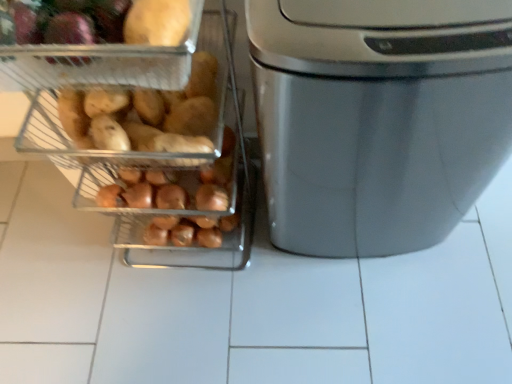
Describe the element at coordinates (378, 118) in the screenshot. I see `satin silver trash can at right` at that location.

This screenshot has height=384, width=512. Identify the location of metallic silver trash can at right. (157, 156).

Find the location of `satin silver trash can at right`. satin silver trash can at right is located at coordinates (378, 118).

Which of these two, satin silver trash can at right or metallic silver trash can at right, is thinner?

satin silver trash can at right.

Would you say satin silver trash can at right is a long distance from metallic silver trash can at right?

No.

Is satin silver trash can at right turned away from metallic silver trash can at right?

No, satin silver trash can at right is not facing the opposite direction of metallic silver trash can at right.

From the image's perspective, relative to metallic silver trash can at right, is satin silver trash can at right above or below?

Clearly, from the image's perspective, satin silver trash can at right is above metallic silver trash can at right.

From the image's perspective, relative to metallic silver trash can at right, is matte yellow potato at upper left above or below?

Based on their image positions, matte yellow potato at upper left is located above metallic silver trash can at right.

Which object is more forward, matte yellow potato at upper left or metallic silver trash can at right?

metallic silver trash can at right is more forward.

From a real-world perspective, which object stands above the other?

matte yellow potato at upper left is physically above.

Where is `food lying on the left of satin silver trash can at right`? Image resolution: width=512 pixels, height=384 pixels. food lying on the left of satin silver trash can at right is located at coordinates (123, 34).

Which is more to the left, satin silver trash can at right or matte yellow potato at upper left?

Positioned to the left is matte yellow potato at upper left.

From a real-world perspective, does satin silver trash can at right stand above matte yellow potato at upper left?

Actually, satin silver trash can at right is physically below matte yellow potato at upper left in the real world.

Considering the positions of objects metallic silver trash can at right and satin silver trash can at right in the image provided, who is more to the left, metallic silver trash can at right or satin silver trash can at right?

metallic silver trash can at right is more to the left.

Between metallic silver trash can at right and satin silver trash can at right, which one has smaller size?

Smaller between the two is metallic silver trash can at right.

How many degrees apart are the facing directions of metallic silver trash can at right and satin silver trash can at right?

The angular difference between metallic silver trash can at right and satin silver trash can at right is 1.18 degrees.

Which is less distant, (224, 236) or (444, 230)?

Clearly, point (224, 236) is more distant from the camera than point (444, 230).

Does metallic silver trash can at right turn towards matte yellow potato at upper left?

No, metallic silver trash can at right is not aimed at matte yellow potato at upper left.

From a real-world perspective, relative to matte yellow potato at upper left, is metallic silver trash can at right vertically above or below?

Clearly, from a real-world perspective, metallic silver trash can at right is below matte yellow potato at upper left.

In the image, is metallic silver trash can at right positioned in front of or behind matte yellow potato at upper left?

metallic silver trash can at right is in front of matte yellow potato at upper left.

Can you confirm if metallic silver trash can at right is positioned to the left of matte yellow potato at upper left?

No, metallic silver trash can at right is not to the left of matte yellow potato at upper left.

Based on the photo, which is closer to the camera, (46,56) or (182,140)?

Point (46,56)

From the image's perspective, is matte yellow potato at upper left on matte brown sweet potato at left?

Indeed, from the image's perspective, matte yellow potato at upper left is shown above matte brown sweet potato at left.

In the image, is matte yellow potato at upper left positioned in front of or behind matte brown sweet potato at left?

Clearly, matte yellow potato at upper left is in front of matte brown sweet potato at left.

Considering the relative sizes of matte brown sweet potato at left and matte yellow potato at upper left in the image provided, is matte brown sweet potato at left thinner than matte yellow potato at upper left?

Yes, matte brown sweet potato at left is thinner than matte yellow potato at upper left.

Considering the sizes of objects matte brown sweet potato at left and matte yellow potato at upper left in the image provided, who is shorter, matte brown sweet potato at left or matte yellow potato at upper left?

With less height is matte brown sweet potato at left.

Which point is more forward, [139,139] or [112,50]?

Positioned in front is point [112,50].

Can you confirm if matte brown sweet potato at left is positioned to the right of matte yellow potato at upper left?

Yes.

Where is `home appliance to the right of metallic silver trash can at right`? home appliance to the right of metallic silver trash can at right is located at coordinates tap(378, 118).

At what (x,y) coordinates should I click in order to perform the action: click on appliance in front of the matte yellow potato at upper left. Please return your answer as a coordinate pair (x, y). Looking at the image, I should click on (157, 156).

When comparing their distances from matte brown sweet potato at left, does satin silver trash can at right or matte yellow potato at upper left seem further?

Among the two, satin silver trash can at right is located further to matte brown sweet potato at left.

Estimate the real-world distances between objects in this image. Which object is further from metallic silver trash can at right, matte yellow potato at upper left or satin silver trash can at right?

matte yellow potato at upper left is further to metallic silver trash can at right.

When comparing their distances from matte yellow potato at upper left, does satin silver trash can at right or matte brown sweet potato at left seem closer?

The object closer to matte yellow potato at upper left is matte brown sweet potato at left.

When comparing their distances from satin silver trash can at right, does matte yellow potato at upper left or metallic silver trash can at right seem further?

The object further to satin silver trash can at right is matte yellow potato at upper left.

In the scene shown: Considering their positions, is matte yellow potato at upper left positioned further to satin silver trash can at right than matte brown sweet potato at left?

Among the two, matte yellow potato at upper left is located further to satin silver trash can at right.

When comparing their distances from matte brown sweet potato at left, does metallic silver trash can at right or satin silver trash can at right seem further?

The object further to matte brown sweet potato at left is satin silver trash can at right.

Which object lies further to the anchor point satin silver trash can at right, metallic silver trash can at right or matte brown sweet potato at left?

matte brown sweet potato at left lies further to satin silver trash can at right than the other object.

Which object lies further to the anchor point satin silver trash can at right, matte brown sweet potato at left or matte yellow potato at upper left?

matte yellow potato at upper left is further to satin silver trash can at right.

This screenshot has width=512, height=384. Find the location of `sweet potato located between matte yellow potato at upper left and satin silver trash can at right in the left-right direction`. sweet potato located between matte yellow potato at upper left and satin silver trash can at right in the left-right direction is located at coordinates (146, 115).

Locate an element on the screen. appliance between matte brown sweet potato at left and satin silver trash can at right is located at coordinates (157, 156).

Identify the location of food between metallic silver trash can at right and matte brown sweet potato at left in the front-back direction. This screenshot has width=512, height=384. (123, 34).

You are a GUI agent. You are given a task and a screenshot of the screen. Output one action in this format:
    pyautogui.click(x=<x>, y=<y>)
    Task: Click on the appliance between matte yellow potato at upper left and satin silver trash can at right from left to right
    This screenshot has width=512, height=384.
    Given the screenshot: What is the action you would take?
    pyautogui.click(x=157, y=156)